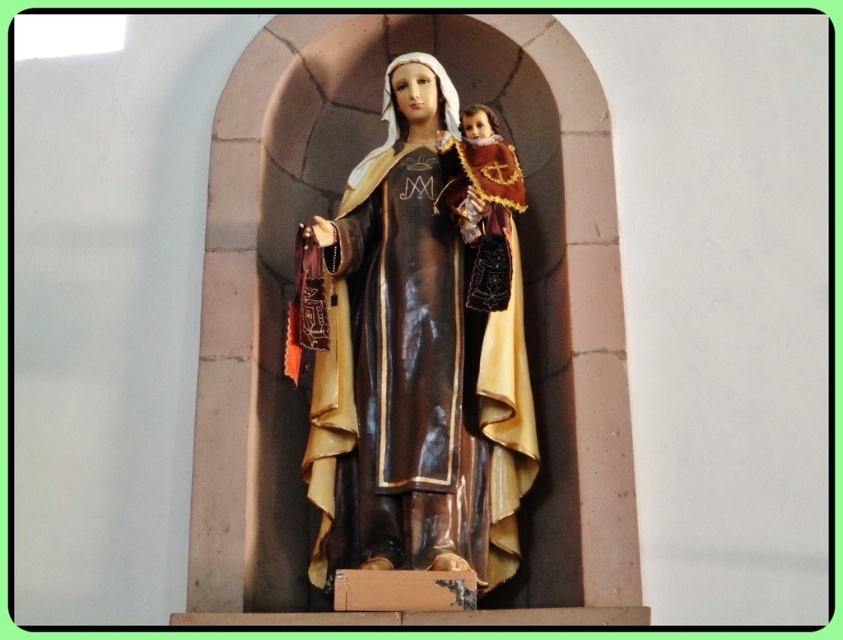
Question: Does matte brown statue at center have a greater width compared to wooden doll at center?

Choices:
 (A) no
 (B) yes

Answer: (B)

Question: Which of the following is the closest to the observer?

Choices:
 (A) wooden doll at center
 (B) matte brown statue at center

Answer: (B)

Question: Does matte brown statue at center appear on the right side of wooden doll at center?

Choices:
 (A) no
 (B) yes

Answer: (A)

Question: Can you confirm if matte brown statue at center is thinner than wooden doll at center?

Choices:
 (A) yes
 (B) no

Answer: (B)

Question: Among these points, which one is nearest to the camera?

Choices:
 (A) (482, 570)
 (B) (487, 179)

Answer: (A)